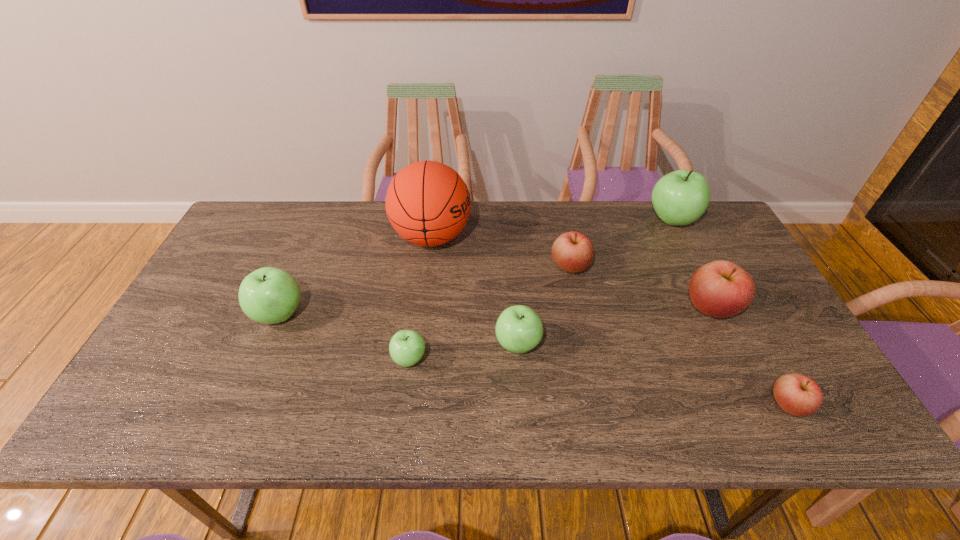
The image size is (960, 540). What are the coordinates of `free space at the right edge of the desktop` in the screenshot? It's located at (791, 363).

This screenshot has width=960, height=540. In the image, there is a desktop. In order to click on vacant area at the far left corner in this screenshot , I will do `click(254, 202)`.

Where is `vacant area at the near left corner of the desktop`? This screenshot has width=960, height=540. vacant area at the near left corner of the desktop is located at coordinates (148, 414).

In the image, there is a desktop. Find the location of `vacant space at the near right corner`. vacant space at the near right corner is located at coordinates (804, 418).

Where is `free spot between the rightmost green apple and the third apple from left to right`? free spot between the rightmost green apple and the third apple from left to right is located at coordinates (595, 282).

The width and height of the screenshot is (960, 540). I want to click on vacant area between the fourth apple from right to left and the smallest green apple, so click(x=490, y=312).

Locate an element on the screen. This screenshot has width=960, height=540. free space between the second farthest red apple and the second farthest apple is located at coordinates (640, 286).

Find the location of a particular element. The image size is (960, 540). vacant space that's between the fifth object from left to right and the basketball is located at coordinates (501, 251).

The width and height of the screenshot is (960, 540). What are the coordinates of `free space between the second green apple from left to right and the leftmost apple` in the screenshot? It's located at click(x=345, y=336).

The width and height of the screenshot is (960, 540). What are the coordinates of `unoccupied area between the farthest apple and the leftmost green apple` in the screenshot? It's located at (475, 267).